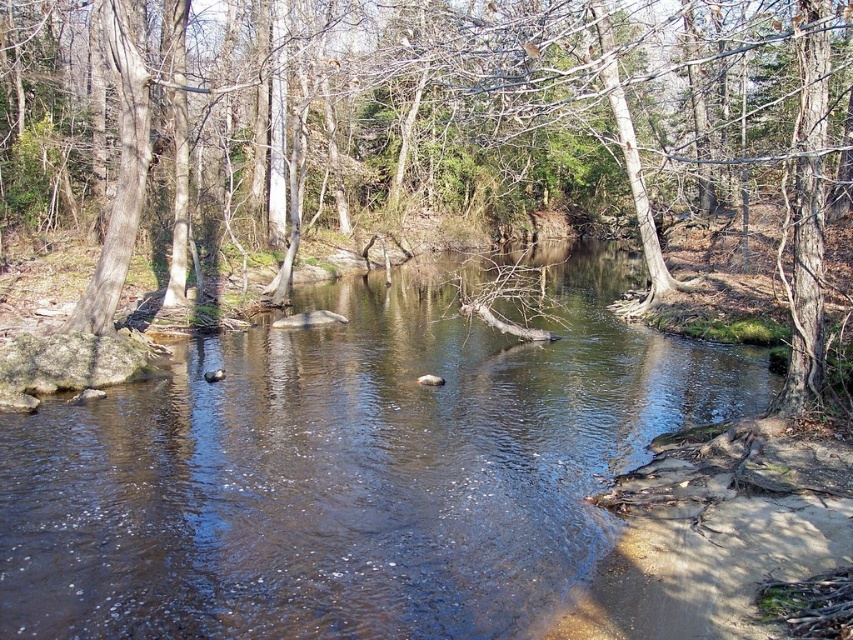
Between brown smooth river at center and brown bark tree at center, which one appears on the right side from the viewer's perspective?

From the viewer's perspective, brown bark tree at center appears more on the right side.

Is point (250, 444) more distant than point (495, 106)?

No, it is not.

Identify the location of brown smooth river at center. This screenshot has height=640, width=853. (350, 468).